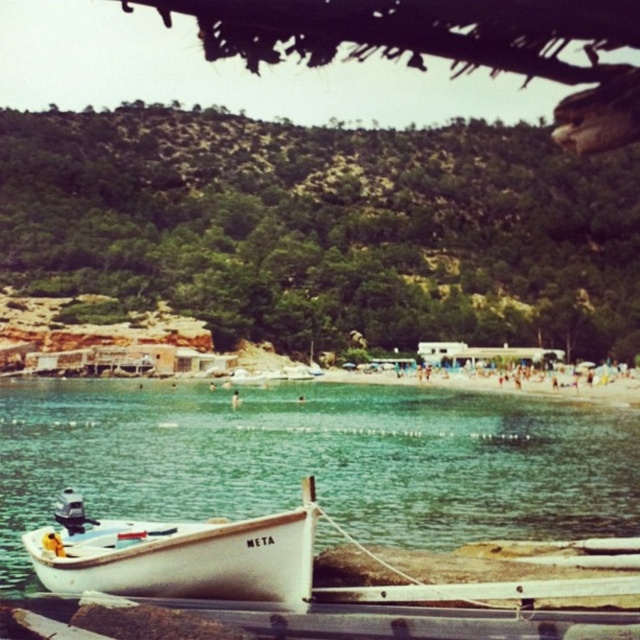
Question: Among these objects, which one is farthest from the camera?

Choices:
 (A) clear water at boat left
 (B) white matte boat at lower left

Answer: (A)

Question: Can you confirm if clear water at boat left is bigger than white matte boat at lower left?

Choices:
 (A) no
 (B) yes

Answer: (B)

Question: Can you confirm if clear water at boat left is smaller than white matte boat at lower left?

Choices:
 (A) no
 (B) yes

Answer: (A)

Question: Which of the following is the closest to the observer?

Choices:
 (A) clear water at boat left
 (B) white matte boat at lower left

Answer: (B)

Question: Does clear water at boat left come behind white matte boat at lower left?

Choices:
 (A) yes
 (B) no

Answer: (A)